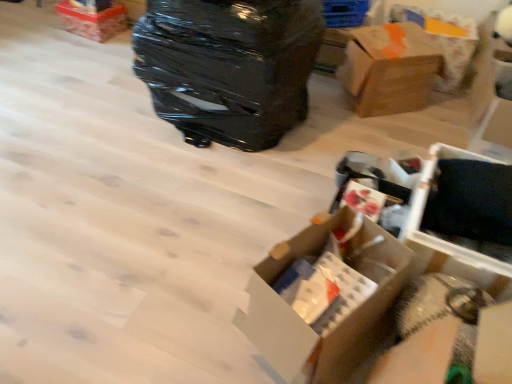
What are the coordinates of `free space between black plastic suitcase at upper center and white cardboard box at center, the 1th box in the bottom-to-top sequence` in the screenshot? It's located at (240, 187).